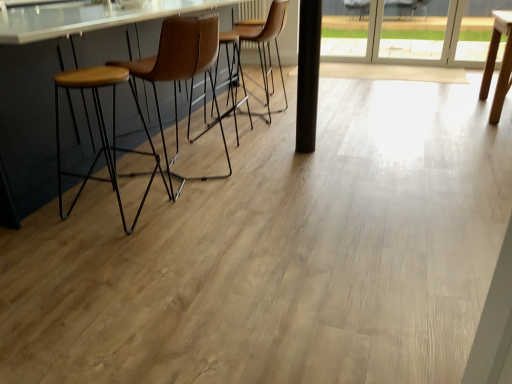
This screenshot has width=512, height=384. I want to click on free space in front of black matte pole at center, so click(x=311, y=155).